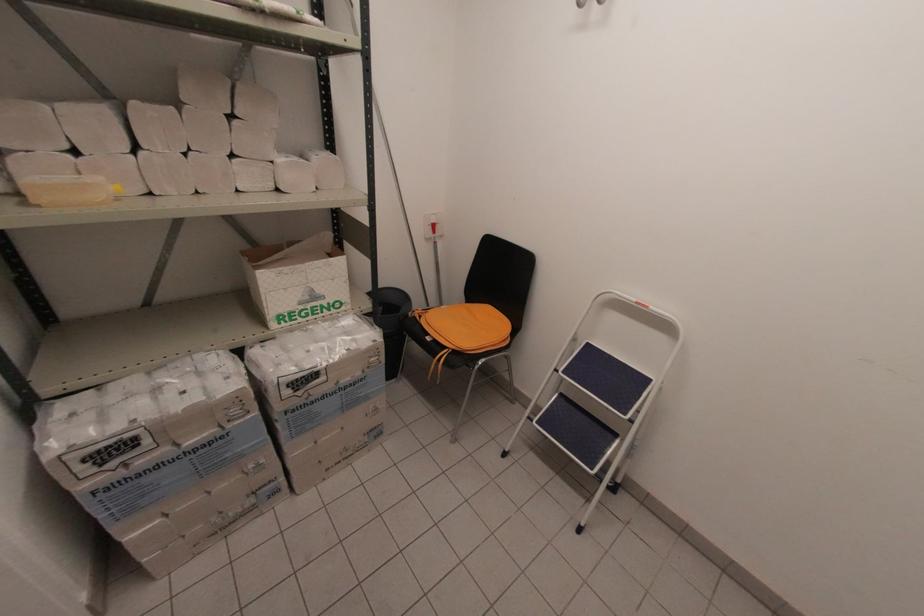
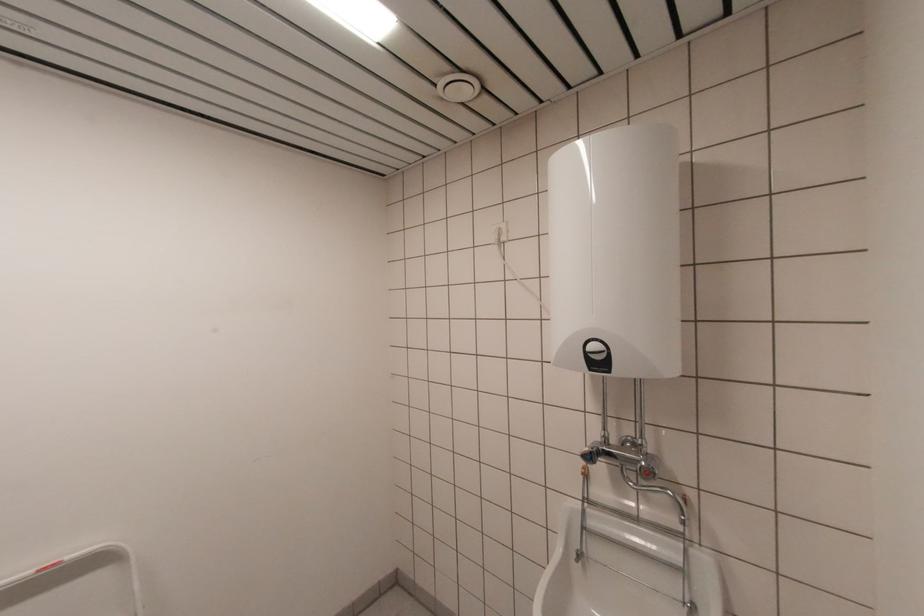
Question: The camera is either moving clockwise (left) or counter-clockwise (right) around the object. The first image is from the beginning of the video and the second image is from the end. Is the camera moving left or right when shooting the video?

Choices:
 (A) Left
 (B) Right

Answer: (A)